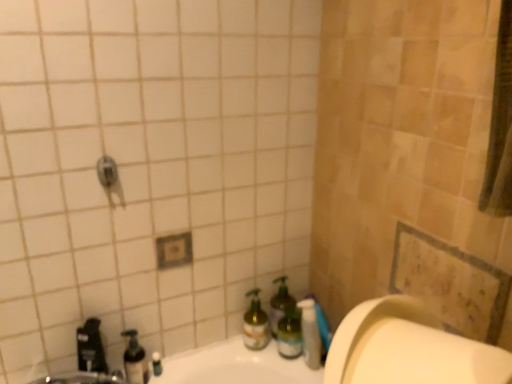
Question: From a real-world perspective, is translucent plastic soap dispenser at lower left, positioned as the 4th bottle in right-to-left order, located beneath brushed metal faucet at lower left?

Choices:
 (A) yes
 (B) no

Answer: (A)

Question: Is translucent plastic soap dispenser at lower left, the first bottle in the left-to-right sequence, closer to the viewer compared to brushed metal faucet at lower left?

Choices:
 (A) no
 (B) yes

Answer: (A)

Question: From the image's perspective, does translucent plastic soap dispenser at lower left, the first bottle in the left-to-right sequence, appear higher than brushed metal faucet at lower left?

Choices:
 (A) no
 (B) yes

Answer: (A)

Question: Is translucent plastic soap dispenser at lower left, positioned as the 4th bottle in right-to-left order, behind brushed metal faucet at lower left?

Choices:
 (A) no
 (B) yes

Answer: (B)

Question: Can you confirm if translucent plastic soap dispenser at lower left, positioned as the 4th bottle in right-to-left order, is positioned to the left of brushed metal faucet at lower left?

Choices:
 (A) no
 (B) yes

Answer: (A)

Question: From the image's perspective, is green glass spray bottle at lower center, the second bottle positioned from the left, under translucent plastic pump bottle at lower center?

Choices:
 (A) yes
 (B) no

Answer: (B)

Question: Considering the relative sizes of green glass spray bottle at lower center, which is counted as the 3th bottle, starting from the right, and translucent plastic pump bottle at lower center in the image provided, is green glass spray bottle at lower center, which is counted as the 3th bottle, starting from the right, wider than translucent plastic pump bottle at lower center?

Choices:
 (A) no
 (B) yes

Answer: (B)

Question: From a real-world perspective, does green glass spray bottle at lower center, which is counted as the 3th bottle, starting from the right, sit lower than translucent plastic pump bottle at lower center?

Choices:
 (A) yes
 (B) no

Answer: (A)

Question: Does green glass spray bottle at lower center, which is counted as the 3th bottle, starting from the right, touch translucent plastic pump bottle at lower center?

Choices:
 (A) no
 (B) yes

Answer: (A)

Question: Is green glass spray bottle at lower center, which is counted as the 3th bottle, starting from the right, in front of translucent plastic pump bottle at lower center?

Choices:
 (A) yes
 (B) no

Answer: (B)

Question: Does translucent plastic soap dispenser at lower left have a larger size compared to green glass bottle at lower center, which is the 3th bottle in left-to-right order?

Choices:
 (A) yes
 (B) no

Answer: (B)